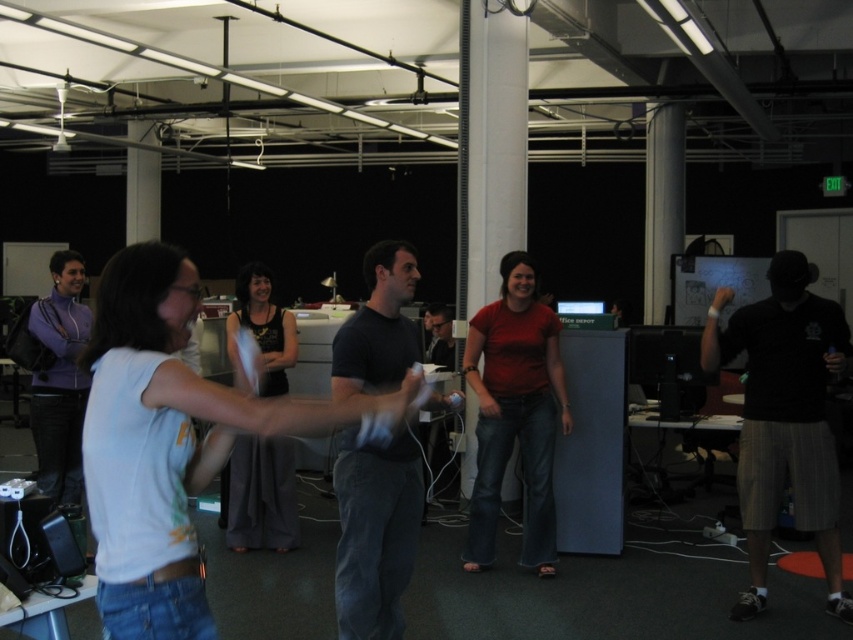
You are standing in the middle of the room and want to hand a controller to someone wearing a black cotton shirt at right and someone wearing a purple fleece jacket at left. Which person is closer to you?

The black cotton shirt at right is 3.64 meters away from purple fleece jacket at left. Since you are in the middle, the distance to each would depend on their positions. However, based on the given information, the purple fleece jacket at left is closer to you because it is on the left side while the black cotton shirt at right is farther on the right side.